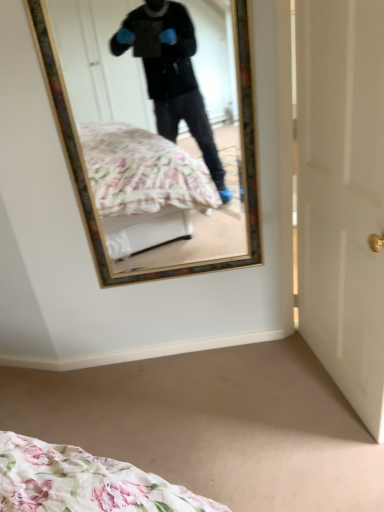
Where is `wooden-framed mirror at upper center`? Image resolution: width=384 pixels, height=512 pixels. wooden-framed mirror at upper center is located at coordinates (153, 130).

Describe the element at coordinates (153, 130) in the screenshot. I see `wooden-framed mirror at upper center` at that location.

This screenshot has height=512, width=384. Describe the element at coordinates (342, 194) in the screenshot. I see `white glossy door at right` at that location.

Locate an element on the screen. The width and height of the screenshot is (384, 512). white glossy door at right is located at coordinates (342, 194).

Consider the image. What is the approximate height of white glossy door at right?

The height of white glossy door at right is 1.43 meters.

I want to click on wooden-framed mirror at upper center, so click(153, 130).

Based on their positions, is white glossy door at right located to the left or right of wooden-framed mirror at upper center?

white glossy door at right is positioned on wooden-framed mirror at upper center's right side.

Is the position of white glossy door at right more distant than that of wooden-framed mirror at upper center?

No, the depth of white glossy door at right is less than that of wooden-framed mirror at upper center.

Which is further, (350, 228) or (172, 260)?

The point (172, 260) is farther.

From the image's perspective, which one is positioned higher, white glossy door at right or wooden-framed mirror at upper center?

wooden-framed mirror at upper center, from the image's perspective.

From a real-world perspective, relative to wooden-framed mirror at upper center, is white glossy door at right vertically above or below?

white glossy door at right is situated lower than wooden-framed mirror at upper center in the real world.

Is white glossy door at right wider than wooden-framed mirror at upper center?

Indeed, white glossy door at right has a greater width compared to wooden-framed mirror at upper center.

From their relative heights in the image, would you say white glossy door at right is taller or shorter than wooden-framed mirror at upper center?

Clearly, white glossy door at right is taller compared to wooden-framed mirror at upper center.

Can you confirm if white glossy door at right is bigger than wooden-framed mirror at upper center?

Yes, white glossy door at right is bigger than wooden-framed mirror at upper center.

Do you think white glossy door at right is within wooden-framed mirror at upper center, or outside of it?

white glossy door at right lies outside wooden-framed mirror at upper center.

Are white glossy door at right and wooden-framed mirror at upper center located far from each other?

No, white glossy door at right is in close proximity to wooden-framed mirror at upper center.

Is white glossy door at right oriented away from wooden-framed mirror at upper center?

Yes, white glossy door at right is facing away from wooden-framed mirror at upper center.

What are the coordinates of `mirror that appears behind the white glossy door at right` in the screenshot? It's located at click(x=153, y=130).

Between wooden-framed mirror at upper center and white glossy door at right, which one appears on the right side from the viewer's perspective?

white glossy door at right is more to the right.

Relative to white glossy door at right, is wooden-framed mirror at upper center in front or behind?

Visually, wooden-framed mirror at upper center is located behind white glossy door at right.

Considering the positions of points (189, 111) and (327, 50), is point (189, 111) closer to camera compared to point (327, 50)?

No, (189, 111) is behind (327, 50).

From the image's perspective, is wooden-framed mirror at upper center located beneath white glossy door at right?

Incorrect, from the image's perspective, wooden-framed mirror at upper center is higher than white glossy door at right.

From a real-world perspective, is wooden-framed mirror at upper center positioned above or below white glossy door at right?

Clearly, from a real-world perspective, wooden-framed mirror at upper center is above white glossy door at right.

Which object is thinner, wooden-framed mirror at upper center or white glossy door at right?

wooden-framed mirror at upper center.

Considering the sizes of objects wooden-framed mirror at upper center and white glossy door at right in the image provided, who is taller, wooden-framed mirror at upper center or white glossy door at right?

white glossy door at right is taller.

Consider the image. Can you confirm if wooden-framed mirror at upper center is smaller than white glossy door at right?

Correct, wooden-framed mirror at upper center occupies less space than white glossy door at right.

Does wooden-framed mirror at upper center contain white glossy door at right?

Actually, white glossy door at right is outside wooden-framed mirror at upper center.

Consider the image. Is there a large distance between wooden-framed mirror at upper center and white glossy door at right?

wooden-framed mirror at upper center is actually quite close to white glossy door at right.

Is wooden-framed mirror at upper center oriented towards white glossy door at right?

No, wooden-framed mirror at upper center is not oriented towards white glossy door at right.

You are a GUI agent. You are given a task and a screenshot of the screen. Output one action in this format:
    pyautogui.click(x=<x>, y=<y>)
    Task: Click on the door to the right of wooden-framed mirror at upper center
    Image resolution: width=384 pixels, height=512 pixels.
    Given the screenshot: What is the action you would take?
    pyautogui.click(x=342, y=194)

You are a GUI agent. You are given a task and a screenshot of the screen. Output one action in this format:
    pyautogui.click(x=<x>, y=<y>)
    Task: Click on the door below the wooden-framed mirror at upper center (from a real-world perspective)
    
    Given the screenshot: What is the action you would take?
    pyautogui.click(x=342, y=194)

Find the location of a particular element. This screenshot has width=384, height=512. mirror on the left of white glossy door at right is located at coordinates (153, 130).